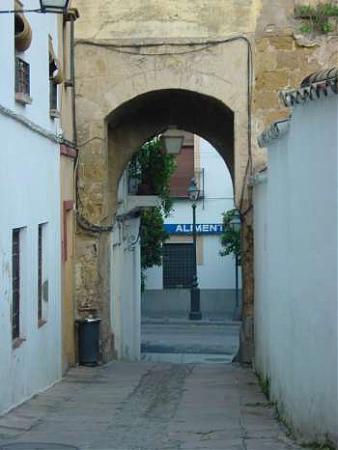
You are a GUI agent. You are given a task and a screenshot of the screen. Output one action in this format:
    pyautogui.click(x=<x>, y=<y>)
    Task: Click on the trash can
    The height and width of the screenshot is (450, 338).
    Given the screenshot: What is the action you would take?
    pyautogui.click(x=88, y=353)